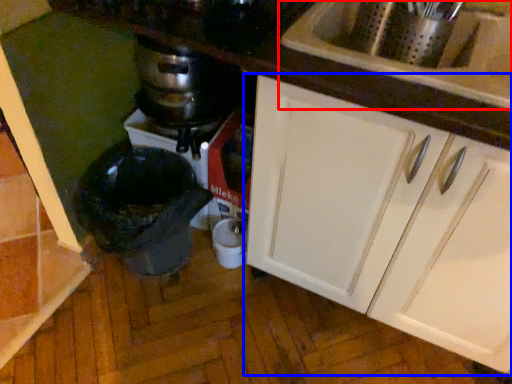
Question: Which of the following is the closest to the observer, sink (highlighted by a red box) or cabinetry (highlighted by a blue box)?

Choices:
 (A) sink
 (B) cabinetry

Answer: (B)